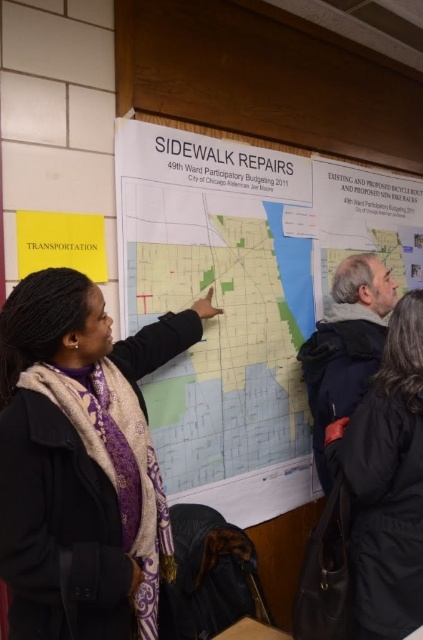
Does matte black scarf at center lie in front of black wool coat at lower right?

Yes, it is in front of black wool coat at lower right.

Based on the photo, between matte black scarf at center and black wool coat at lower right, which one is positioned higher?

matte black scarf at center is above.

The width and height of the screenshot is (423, 640). What are the coordinates of `matte black scarf at center` in the screenshot? It's located at (82, 461).

Does white paper map at center appear over light blue paper map at center?

Yes, white paper map at center is above light blue paper map at center.

Who is positioned more to the right, white paper map at center or light blue paper map at center?

white paper map at center

Measure the distance between point (x=233, y=221) and camera.

2.08 meters

I want to click on white paper map at center, so click(244, 296).

Who is taller, matte black scarf at center or light blue paper map at center?

With more height is light blue paper map at center.

Is matte black scarf at center positioned behind light blue paper map at center?

No, it is not.

What do you see at coordinates (82, 461) in the screenshot? This screenshot has width=423, height=640. I see `matte black scarf at center` at bounding box center [82, 461].

Where is `matte black scarf at center`? This screenshot has height=640, width=423. matte black scarf at center is located at coordinates (82, 461).